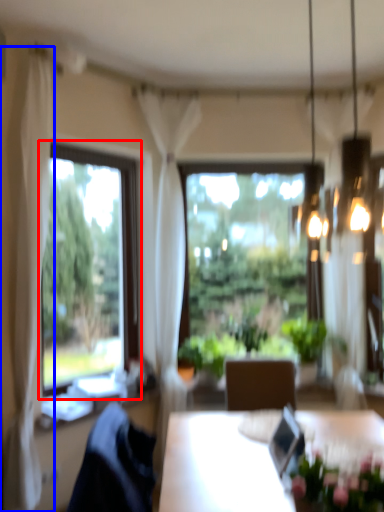
Question: Which of the following is the farthest to the observer, window (highlighted by a red box) or curtain (highlighted by a blue box)?

Choices:
 (A) window
 (B) curtain

Answer: (A)